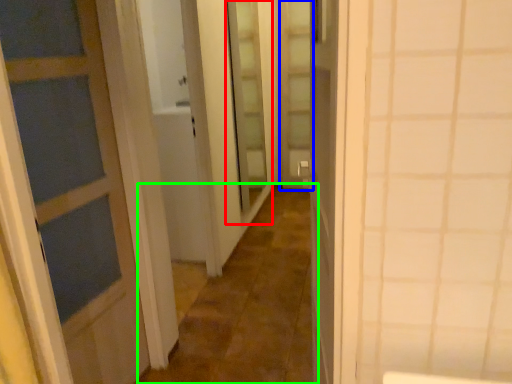
Question: Based on their relative distances, which object is farther from screen door (highlighted by a red box)? Choose from screen door (highlighted by a blue box) and alley (highlighted by a green box).

Choices:
 (A) screen door
 (B) alley

Answer: (B)